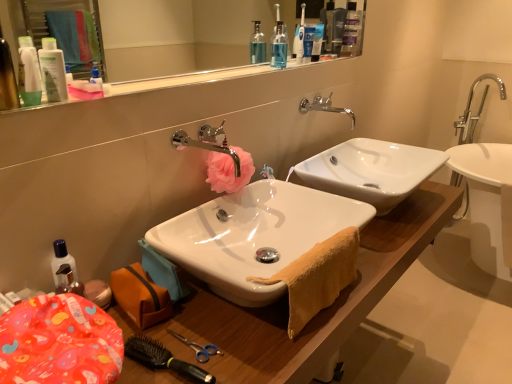
The image size is (512, 384). Identify the location of wooden cabinet at lower left. (287, 302).

What do you see at coordinates (317, 277) in the screenshot?
I see `yellow terry cloth towel at lower center` at bounding box center [317, 277].

What is the approximate height of white plastic toothbrush at upper center?

white plastic toothbrush at upper center is 9.41 inches in height.

The height and width of the screenshot is (384, 512). What do you see at coordinates (307, 42) in the screenshot?
I see `white plastic toothpaste tube at upper center, which ranks as the 1th toiletry in top-to-bottom order` at bounding box center [307, 42].

What is the approximate width of transparent plastic mouthwash at upper center?

2.49 inches.

This screenshot has width=512, height=384. Describe the element at coordinates (254, 235) in the screenshot. I see `white glossy sink at center, the second sink when ordered from back to front` at that location.

Locate an element on the screen. Image resolution: width=512 pixels, height=384 pixels. white glossy sink at center, which is counted as the 1th sink, starting from the front is located at coordinates (254, 235).

What do you see at coordinates (198, 347) in the screenshot?
I see `black plastic brush at lower left, placed as the second brush when sorted from front to back` at bounding box center [198, 347].

Identify the location of wooden cabinet at lower left. (287, 302).

Based on their positions, is white glossy sink at center, acting as the 1th sink starting from the back, located to the left or right of white plastic toothpaste tube at upper center, positioned as the 1th toiletry in back-to-front order?

Based on their positions, white glossy sink at center, acting as the 1th sink starting from the back, is located to the right of white plastic toothpaste tube at upper center, positioned as the 1th toiletry in back-to-front order.

From the image's perspective, is white glossy sink at center, the second sink viewed from the front, above or below white plastic toothpaste tube at upper center, which is the 3th toiletry from front to back?

Clearly, from the image's perspective, white glossy sink at center, the second sink viewed from the front, is below white plastic toothpaste tube at upper center, which is the 3th toiletry from front to back.

Does white glossy sink at center, the second sink viewed from the front, have a greater height compared to white plastic toothpaste tube at upper center, the third toiletry from the bottom?

Yes, white glossy sink at center, the second sink viewed from the front, is taller than white plastic toothpaste tube at upper center, the third toiletry from the bottom.

Is white glossy sink at center, the second sink viewed from the front, not inside white plastic toothpaste tube at upper center, which ranks as the 1th toiletry in top-to-bottom order?

white glossy sink at center, the second sink viewed from the front, is positioned outside white plastic toothpaste tube at upper center, which ranks as the 1th toiletry in top-to-bottom order.

Is yellow terry cloth towel at lower center aimed at white plastic toothbrush at upper center?

No, yellow terry cloth towel at lower center is not turned towards white plastic toothbrush at upper center.

Consider the image. Does yellow terry cloth towel at lower center come in front of white plastic toothbrush at upper center?

Yes.

From the image's perspective, which is above, yellow terry cloth towel at lower center or white plastic toothbrush at upper center?

white plastic toothbrush at upper center is shown above in the image.

From a real-world perspective, who is located higher, yellow terry cloth towel at lower center or white plastic toothbrush at upper center?

white plastic toothbrush at upper center is physically above.

Consider the image. Is matte white lotion at upper left, acting as the first toiletry starting from the front, at the left side of wooden cabinet at lower left?

Indeed, matte white lotion at upper left, acting as the first toiletry starting from the front, is positioned on the left side of wooden cabinet at lower left.

Is the position of matte white lotion at upper left, which ranks as the 3th toiletry in top-to-bottom order, more distant than that of wooden cabinet at lower left?

That is True.

Considering the points (27, 46) and (436, 230), which point is in front, point (27, 46) or point (436, 230)?

The point (27, 46) is closer.

Which object is wider, wooden cabinet at lower left or white plastic toothbrush at upper center?

wooden cabinet at lower left.

Is wooden cabinet at lower left taller or shorter than white plastic toothbrush at upper center?

wooden cabinet at lower left is taller than white plastic toothbrush at upper center.

This screenshot has width=512, height=384. I want to click on toothbrush above the wooden cabinet at lower left (from a real-world perspective), so click(x=300, y=37).

Is wooden cabinet at lower left directly adjacent to white plastic toothbrush at upper center?

No.

Considering the relative sizes of matte plastic container at lower left and white plastic toothpaste tube at upper center, which appears as the 3th toiletry when viewed from the left, in the image provided, is matte plastic container at lower left bigger than white plastic toothpaste tube at upper center, which appears as the 3th toiletry when viewed from the left,?

Indeed, matte plastic container at lower left has a larger size compared to white plastic toothpaste tube at upper center, which appears as the 3th toiletry when viewed from the left.

Is matte plastic container at lower left not inside white plastic toothpaste tube at upper center, which is the 3th toiletry from front to back?

Yes.

Considering the sizes of matte plastic container at lower left and white plastic toothpaste tube at upper center, placed as the 1th toiletry when sorted from right to left, in the image, is matte plastic container at lower left wider or thinner than white plastic toothpaste tube at upper center, placed as the 1th toiletry when sorted from right to left,?

In the image, matte plastic container at lower left appears to be wider than white plastic toothpaste tube at upper center, placed as the 1th toiletry when sorted from right to left.

From the picture: Which object is more forward, transparent plastic mouthwash at upper center or chrome metallic faucet at center, which is the 2th tap in back-to-front order?

Positioned in front is chrome metallic faucet at center, which is the 2th tap in back-to-front order.

Is transparent plastic mouthwash at upper center oriented away from chrome metallic faucet at center, acting as the 2th tap starting from the top?

No, transparent plastic mouthwash at upper center's orientation is not away from chrome metallic faucet at center, acting as the 2th tap starting from the top.

Considering the sizes of objects transparent plastic mouthwash at upper center and chrome metallic faucet at center, acting as the 2th tap starting from the top, in the image provided, who is taller, transparent plastic mouthwash at upper center or chrome metallic faucet at center, acting as the 2th tap starting from the top,?

With more height is transparent plastic mouthwash at upper center.

From the image's perspective, which object appears higher, transparent plastic mouthwash at upper center or chrome metallic faucet at center, which is the 2th tap in back-to-front order?

transparent plastic mouthwash at upper center.

From a real-world perspective, who is located lower, matte plastic container at lower left or yellow terry cloth towel at lower center?

yellow terry cloth towel at lower center, from a real-world perspective.

Considering the positions of point (76, 332) and point (289, 310), is point (76, 332) closer or farther from the camera than point (289, 310)?

Point (76, 332) appears to be closer to the viewer than point (289, 310).

Is matte plastic container at lower left directly adjacent to yellow terry cloth towel at lower center?

No, matte plastic container at lower left is not with yellow terry cloth towel at lower center.

Consider the image. Based on their positions, is matte plastic container at lower left located to the left or right of yellow terry cloth towel at lower center?

In the image, matte plastic container at lower left appears on the left side of yellow terry cloth towel at lower center.

I want to click on sink that appears on the right of white plastic toothpaste tube at upper center, placed as the 1th toiletry when sorted from right to left, so click(371, 171).

This screenshot has height=384, width=512. I want to click on bath towel that appears below the white plastic toothbrush at upper center (from the image's perspective), so click(x=317, y=277).

When comparing their distances from matte white lotion at upper left, acting as the first toiletry starting from the front, does clear glass mirror at upper center or white plastic toothbrush at upper center seem closer?

Among the two, white plastic toothbrush at upper center is located nearer to matte white lotion at upper left, acting as the first toiletry starting from the front.

Consider the image. Which object lies nearer to the anchor point white glossy sink at center, acting as the 1th sink starting from the back, black plastic brush at lower left, acting as the 1th brush starting from the back, or white plastic toothpaste tube at upper center, the third toiletry from the bottom?

The object closer to white glossy sink at center, acting as the 1th sink starting from the back, is white plastic toothpaste tube at upper center, the third toiletry from the bottom.

Based on their spatial positions, is transparent plastic mouthwash at upper center or pink fabric flower at center further from white glossy sink at center, which is counted as the 1th sink, starting from the front?

transparent plastic mouthwash at upper center.

Which object lies further to the anchor point black plastic brush at lower left, placed as the second brush when sorted from front to back, white plastic toothpaste tube at upper center, positioned as the 1th toiletry in back-to-front order, or chrome metallic faucet at center, which appears as the 1th tap when ordered from the bottom?

Based on the image, white plastic toothpaste tube at upper center, positioned as the 1th toiletry in back-to-front order, appears to be further to black plastic brush at lower left, placed as the second brush when sorted from front to back.

From the image, which object appears to be farther from translucent plastic bottles at upper center, white glossy sink at center, the second sink viewed from the front, or transparent plastic mouthwash at upper center?

white glossy sink at center, the second sink viewed from the front, is positioned further to the anchor translucent plastic bottles at upper center.

Looking at the image, which one is located closer to translucent plastic bottles at upper center, matte plastic container at lower left or white glossy lotion at upper left, the second toiletry in the left-to-right sequence?

white glossy lotion at upper left, the second toiletry in the left-to-right sequence, is closer to translucent plastic bottles at upper center.

From the image, which object appears to be farther from white glossy sink at center, which is counted as the 1th sink, starting from the front, yellow terry cloth towel at lower center or chrome metallic faucet at center, which appears as the 1th tap when ordered from the bottom?

Based on the image, chrome metallic faucet at center, which appears as the 1th tap when ordered from the bottom, appears to be further to white glossy sink at center, which is counted as the 1th sink, starting from the front.

Which object lies further to the anchor point clear glass mirror at upper center, transparent plastic mouthwash at upper center or black plastic brush at lower left, acting as the 1th brush starting from the back?

Based on the image, black plastic brush at lower left, acting as the 1th brush starting from the back, appears to be further to clear glass mirror at upper center.

Locate an element on the screen. The width and height of the screenshot is (512, 384). toothbrush located between clear glass mirror at upper center and translucent plastic bottles at upper center in the depth direction is located at coordinates (300, 37).

Find the location of `flower between yellow terry cloth towel at lower center and translucent plastic bottles at upper center in the front-back direction`. flower between yellow terry cloth towel at lower center and translucent plastic bottles at upper center in the front-back direction is located at coordinates (229, 171).

The image size is (512, 384). I want to click on sink located between white glossy lotion at upper left, the second toiletry in the left-to-right sequence, and wooden cabinet at lower left in the left-right direction, so click(254, 235).

Find the location of a particular element. The image size is (512, 384). bath towel between white glossy sink at center, the second sink when ordered from back to front, and silver metallic faucet at upper center, the first tap in the right-to-left sequence, from front to back is located at coordinates (317, 277).